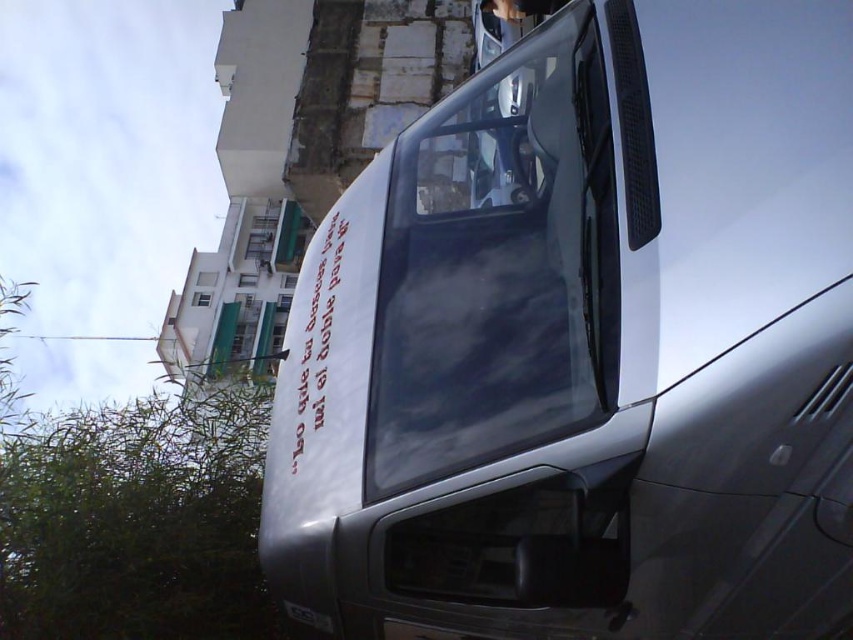
Does point (461, 618) lie in front of point (199, 298)?

Yes, it is.

Between point (360, 515) and point (206, 296), which one is positioned in front?

Point (360, 515) is more forward.

At what (x,y) coordinates should I click in order to perform the action: click on satin metallic van at center. Please return your answer as a coordinate pair (x, y). Looking at the image, I should click on (584, 346).

Measure the distance between satin metallic van at center and camera.

satin metallic van at center is 4.67 feet away from camera.

Which is in front, point (447, 467) or point (492, 323)?

Point (447, 467)

Who is more distant from viewer, (442, 317) or (531, 145)?

The point (531, 145) is more distant.

The width and height of the screenshot is (853, 640). In order to click on satin metallic van at center in this screenshot , I will do `click(584, 346)`.

Who is taller, transparent glass windshield at center or white glass window at upper left?

Standing taller between the two is transparent glass windshield at center.

Can you confirm if transparent glass windshield at center is bigger than white glass window at upper left?

Yes.

Is point (601, 408) behind point (201, 300)?

No, it is not.

This screenshot has height=640, width=853. Identify the location of transparent glass windshield at center. (x=497, y=266).